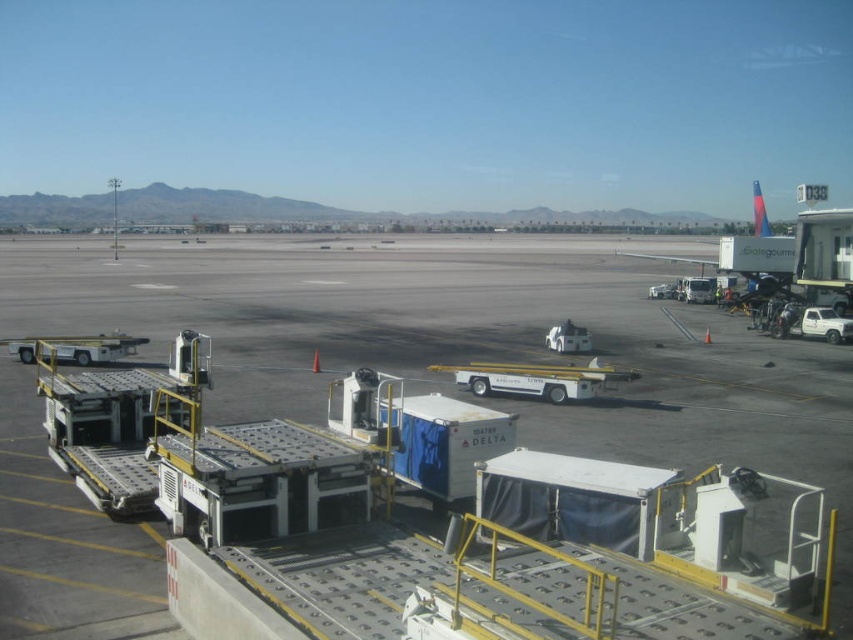
Where is `metallic gray tarmac at center`? This screenshot has width=853, height=640. metallic gray tarmac at center is located at coordinates (463, 339).

Who is more forward, (247, 396) or (633, 253)?

Positioned in front is point (247, 396).

Who is more distant from viewer, (x=321, y=280) or (x=761, y=195)?

The point (x=761, y=195) is more distant.

The image size is (853, 640). I want to click on metallic gray tarmac at center, so click(463, 339).